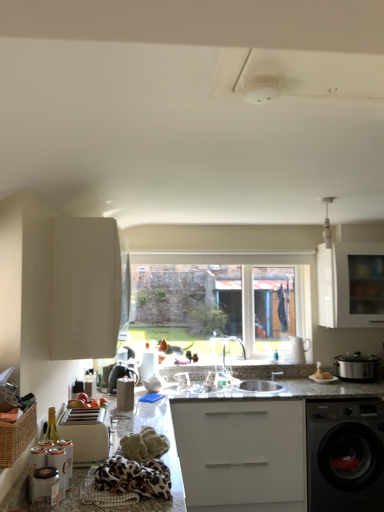
Question: Is the position of woven brown basket at lower left less distant than that of silver metallic tap at center?

Choices:
 (A) yes
 (B) no

Answer: (A)

Question: Is silver metallic tap at center at the back of woven brown basket at lower left?

Choices:
 (A) yes
 (B) no

Answer: (B)

Question: Can you confirm if woven brown basket at lower left is wider than silver metallic tap at center?

Choices:
 (A) yes
 (B) no

Answer: (B)

Question: Is woven brown basket at lower left bigger than silver metallic tap at center?

Choices:
 (A) no
 (B) yes

Answer: (A)

Question: From a real-world perspective, is woven brown basket at lower left positioned under silver metallic tap at center based on gravity?

Choices:
 (A) yes
 (B) no

Answer: (B)

Question: Does point (94, 439) appear closer or farther from the camera than point (142, 411)?

Choices:
 (A) closer
 (B) farther

Answer: (A)

Question: Is beige plastic toaster at lower left, which is counted as the second appliance, starting from the front, wider or thinner than granite countertop at lower left, the first countertop from the left?

Choices:
 (A) wide
 (B) thin

Answer: (B)

Question: Based on their sizes in the image, would you say beige plastic toaster at lower left, which is counted as the second appliance, starting from the front, is bigger or smaller than granite countertop at lower left, the second countertop positioned from the right?

Choices:
 (A) small
 (B) big

Answer: (A)

Question: In the image, is beige plastic toaster at lower left, which is counted as the second appliance, starting from the front, on the left side or the right side of granite countertop at lower left, the first countertop from the left?

Choices:
 (A) right
 (B) left

Answer: (B)

Question: From a real-world perspective, is silver metallic tap at center positioned above or below matte silver pot at right?

Choices:
 (A) above
 (B) below

Answer: (A)

Question: Is silver metallic tap at center wider or thinner than matte silver pot at right?

Choices:
 (A) thin
 (B) wide

Answer: (A)

Question: Does point pyautogui.click(x=226, y=336) appear closer or farther from the camera than point pyautogui.click(x=355, y=368)?

Choices:
 (A) farther
 (B) closer

Answer: (A)

Question: Is silver metallic tap at center inside or outside of matte silver pot at right?

Choices:
 (A) inside
 (B) outside

Answer: (B)

Question: Considering the positions of granite countertop at lower left, the second countertop positioned from the right, and beige plastic toaster at lower left, which is counted as the second appliance, starting from the front, in the image, is granite countertop at lower left, the second countertop positioned from the right, bigger or smaller than beige plastic toaster at lower left, which is counted as the second appliance, starting from the front,?

Choices:
 (A) small
 (B) big

Answer: (B)

Question: From a real-world perspective, is granite countertop at lower left, the second countertop positioned from the right, above or below beige plastic toaster at lower left, the first appliance from the back?

Choices:
 (A) above
 (B) below

Answer: (B)